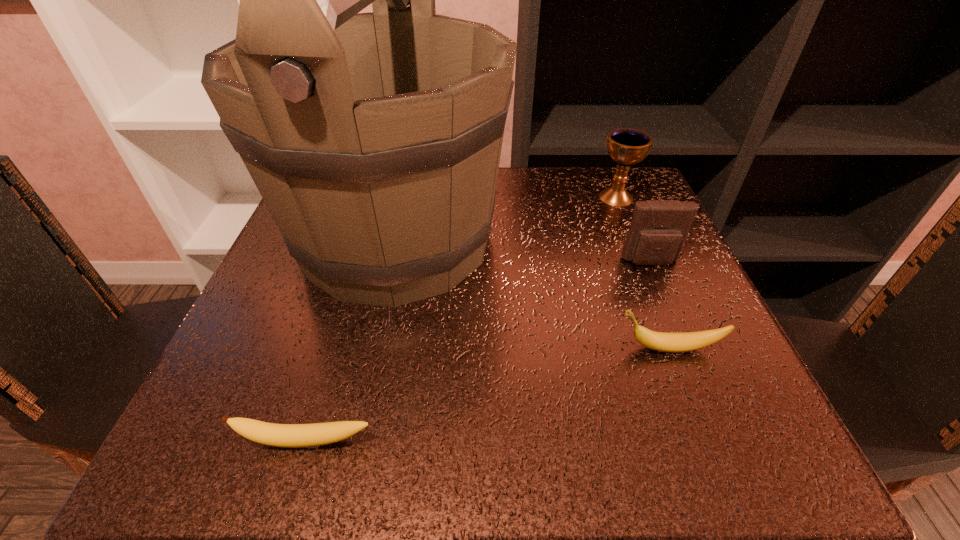
Find the location of a particular element. This screenshot has width=960, height=540. blank region between the chalice and the shorter banana is located at coordinates (461, 320).

Find the location of a particular element. Image resolution: width=960 pixels, height=540 pixels. free point between the pouch and the farther banana is located at coordinates (660, 305).

Image resolution: width=960 pixels, height=540 pixels. Identify the location of vacant area between the farther banana and the shorter banana. (488, 395).

At what (x,y) coordinates should I click in order to perform the action: click on vacant area that lies between the chalice and the shorter banana. Please return your answer as a coordinate pair (x, y). Looking at the image, I should click on (461, 320).

Find the location of a particular element. The height and width of the screenshot is (540, 960). vacant area between the tallest object and the fourth tallest object is located at coordinates (532, 294).

Identify the location of free space between the pouch and the tallest object. (523, 251).

Identify the location of empty space that is in between the tallest object and the shortest object. The height and width of the screenshot is (540, 960). (351, 341).

Where is `object identified as the closest to the tallest object`? object identified as the closest to the tallest object is located at coordinates (x=661, y=341).

Find the location of a particular element. Image resolution: width=960 pixels, height=540 pixels. object that is the third closest to the left banana is located at coordinates (659, 228).

Locate an element on the screen. This screenshot has width=960, height=540. vacant space that satisfies the following two spatial constraints: 1. at the stem of the right banana; 2. on the upward curve of the nearest object is located at coordinates [705, 442].